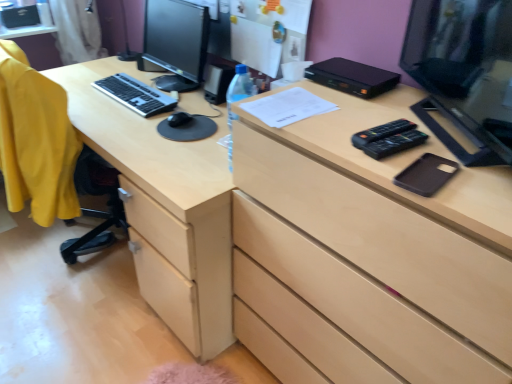
You are a GUI agent. You are given a task and a screenshot of the screen. Output one action in this format:
    pyautogui.click(x=<x>, y=<y>)
    Task: Click on the free space between black matte phone case at right and white paper at center
    
    Given the screenshot: What is the action you would take?
    pyautogui.click(x=347, y=134)